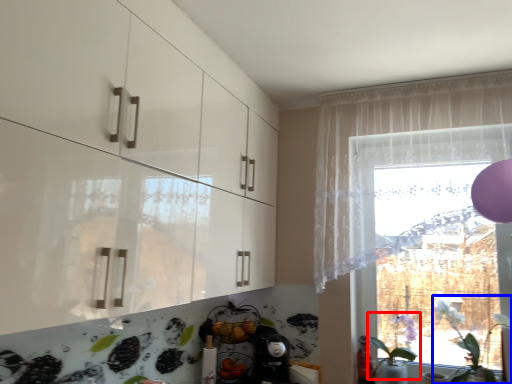
Question: Among these objects, which one is farthest to the camera, plant (highlighted by a red box) or plant (highlighted by a blue box)?

Choices:
 (A) plant
 (B) plant

Answer: (A)